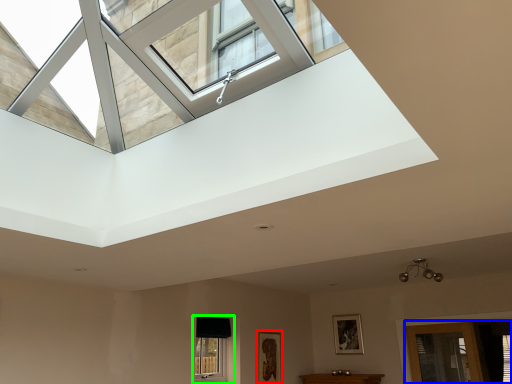
Question: Which object is positioned farthest from picture frame (highlighted by a red box)? Select from glass door (highlighted by a blue box) and window (highlighted by a green box).

Choices:
 (A) glass door
 (B) window

Answer: (A)